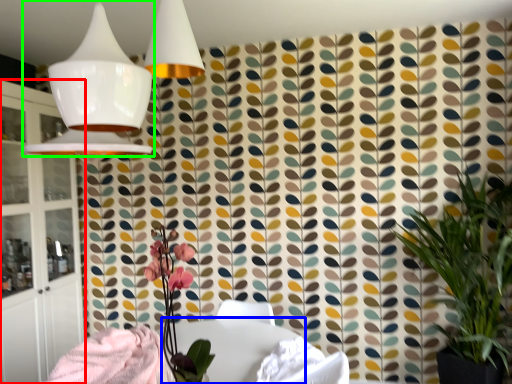
Question: Estimate the real-world distances between objects in this image. Which object is closer to cabinetry (highlighted by a red box), round table (highlighted by a blue box) or lamp (highlighted by a green box)?

Choices:
 (A) round table
 (B) lamp

Answer: (A)